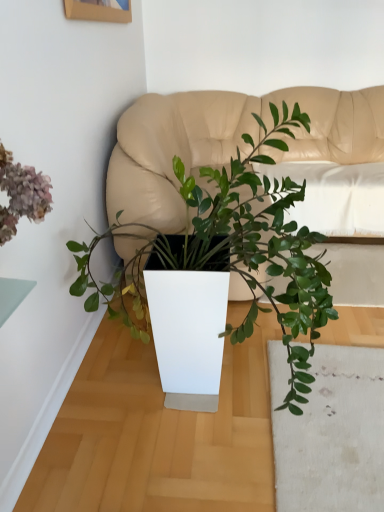
The image size is (384, 512). Find the location of `matte beige couch at center`. matte beige couch at center is located at coordinates (228, 142).

This screenshot has height=512, width=384. What do you see at coordinates (228, 142) in the screenshot? I see `matte beige couch at center` at bounding box center [228, 142].

Measure the distance between green matte plant at center and camera.

green matte plant at center is 1.10 meters away from camera.

The image size is (384, 512). I want to click on green matte plant at center, so click(x=231, y=251).

The width and height of the screenshot is (384, 512). Describe the element at coordinates (231, 251) in the screenshot. I see `green matte plant at center` at that location.

Where is `matte beige couch at center`? This screenshot has width=384, height=512. matte beige couch at center is located at coordinates (228, 142).

Is matte beige couch at center to the left or to the right of green matte plant at center in the image?

Based on their positions, matte beige couch at center is located to the right of green matte plant at center.

Which is behind, matte beige couch at center or green matte plant at center?

matte beige couch at center.

Does point (312, 114) come closer to viewer compared to point (230, 223)?

No, it is behind (230, 223).

In the scene shown: From the image's perspective, is matte beige couch at center under green matte plant at center?

Actually, matte beige couch at center appears above green matte plant at center in the image.

From a real-world perspective, which is physically below, matte beige couch at center or green matte plant at center?

matte beige couch at center is physically lower.

Which of these two, matte beige couch at center or green matte plant at center, is thinner?

green matte plant at center is thinner.

Does matte beige couch at center have a greater height compared to green matte plant at center?

In fact, matte beige couch at center may be shorter than green matte plant at center.

Between matte beige couch at center and green matte plant at center, which one has smaller size?

Smaller between the two is green matte plant at center.

Is matte beige couch at center not within green matte plant at center?

matte beige couch at center is positioned outside green matte plant at center.

Are matte beige couch at center and green matte plant at center located far from each other?

No, matte beige couch at center is not far away from green matte plant at center.

Could you tell me if matte beige couch at center is turned towards green matte plant at center?

Yes, matte beige couch at center is aimed at green matte plant at center.

Can you tell me how much matte beige couch at center and green matte plant at center differ in facing direction?

The facing directions of matte beige couch at center and green matte plant at center are 90.3 degrees apart.

Identify the location of couch below the green matte plant at center (from a real-world perspective). Image resolution: width=384 pixels, height=512 pixels. (228, 142).

Considering the positions of objects green matte plant at center and matte beige couch at center in the image provided, who is more to the left, green matte plant at center or matte beige couch at center?

From the viewer's perspective, green matte plant at center appears more on the left side.

Which is behind, green matte plant at center or matte beige couch at center?

matte beige couch at center is further away from the camera.

Does point (313, 271) lie in front of point (247, 115)?

Yes, it is in front of point (247, 115).

From the image's perspective, would you say green matte plant at center is positioned over matte beige couch at center?

No, from the image's perspective, green matte plant at center is not above matte beige couch at center.

From a real-world perspective, is green matte plant at center physically below matte beige couch at center?

Actually, green matte plant at center is physically above matte beige couch at center in the real world.

In terms of width, does green matte plant at center look wider or thinner when compared to matte beige couch at center?

green matte plant at center is thinner than matte beige couch at center.

Can you confirm if green matte plant at center is shorter than matte beige couch at center?

No.

Which of these two, green matte plant at center or matte beige couch at center, is smaller?

green matte plant at center is smaller.

Can matte beige couch at center be found inside green matte plant at center?

Actually, matte beige couch at center is outside green matte plant at center.

Is there a large distance between green matte plant at center and matte beige couch at center?

No, there isn't a large distance between green matte plant at center and matte beige couch at center.

Does green matte plant at center turn towards matte beige couch at center?

No, green matte plant at center does not turn towards matte beige couch at center.

How far apart are green matte plant at center and matte beige couch at center?

A distance of 70.03 centimeters exists between green matte plant at center and matte beige couch at center.

Where is `couch above the green matte plant at center (from the image's perspective)`? couch above the green matte plant at center (from the image's perspective) is located at coordinates (228, 142).

This screenshot has width=384, height=512. In the image, there is a matte beige couch at center. In order to click on houseplant below it (from the image's perspective) in this screenshot , I will do `click(231, 251)`.

The height and width of the screenshot is (512, 384). In order to click on couch that appears on the right of green matte plant at center in this screenshot , I will do `click(228, 142)`.